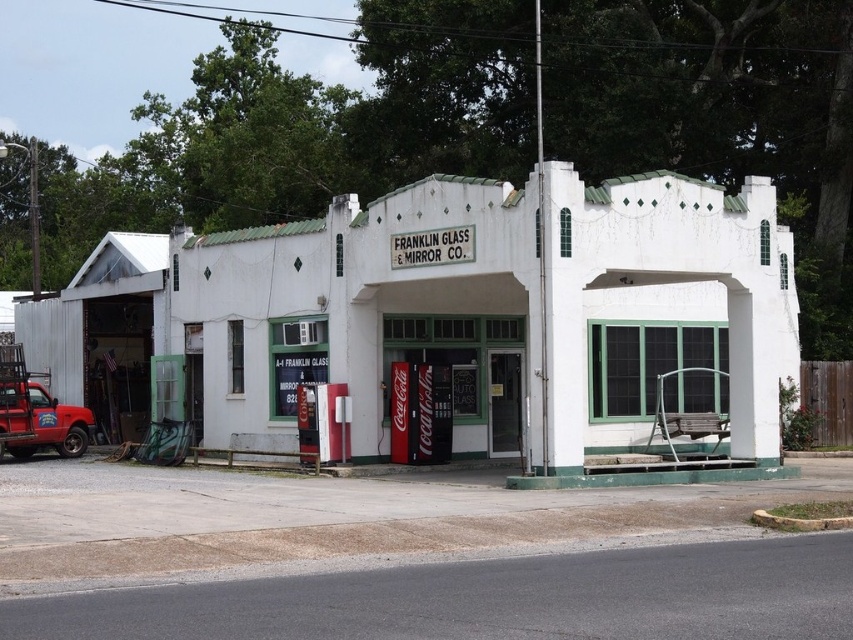
Question: Is white painted building at center positioned before matte red truck at left?

Choices:
 (A) no
 (B) yes

Answer: (B)

Question: Which object appears farthest from the camera in this image?

Choices:
 (A) matte red truck at left
 (B) white painted building at center

Answer: (A)

Question: From the image, what is the correct spatial relationship of white painted building at center in relation to matte red truck at left?

Choices:
 (A) left
 (B) right

Answer: (B)

Question: Which of the following is the farthest from the observer?

Choices:
 (A) white painted building at center
 (B) matte red truck at left

Answer: (B)

Question: Which object appears closest to the camera in this image?

Choices:
 (A) matte red truck at left
 (B) white painted building at center

Answer: (B)

Question: Can you confirm if white painted building at center is bigger than matte red truck at left?

Choices:
 (A) no
 (B) yes

Answer: (B)